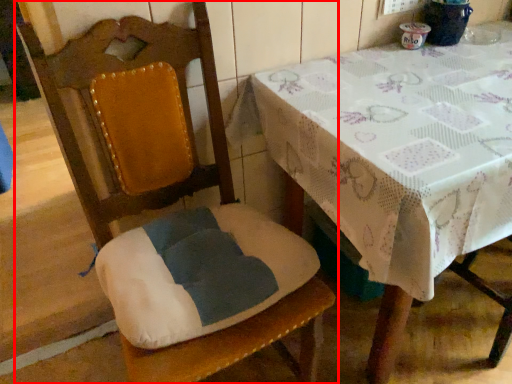
Question: Where is chair (annotated by the red box) located in relation to table in the image?

Choices:
 (A) right
 (B) left

Answer: (B)